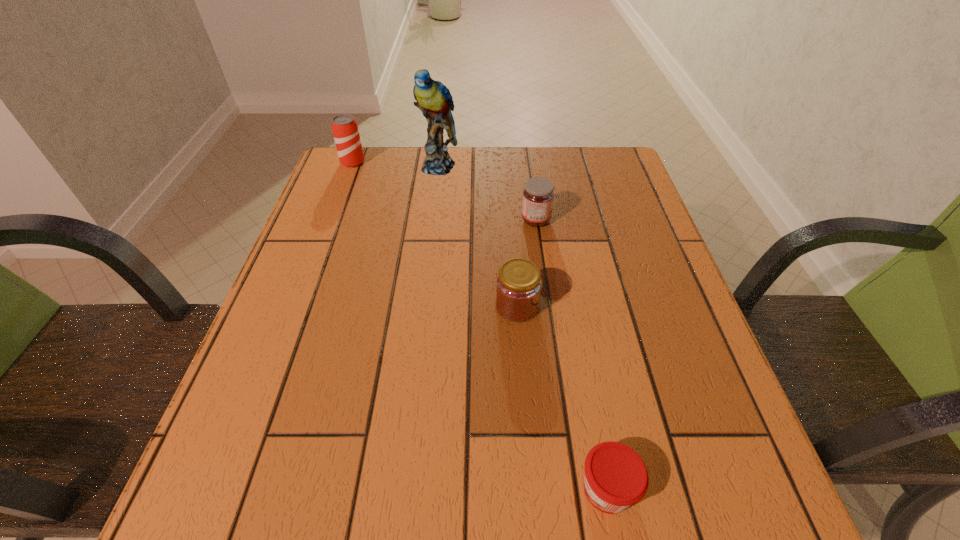
Find the location of a particular element. free space at the far edge of the desktop is located at coordinates (561, 157).

The image size is (960, 540). Find the location of `vacant space at the left edge of the desktop`. vacant space at the left edge of the desktop is located at coordinates (323, 211).

The height and width of the screenshot is (540, 960). In order to click on vacant region at the right edge of the desktop in this screenshot , I will do `click(645, 263)`.

Locate an element on the screen. free space at the far left corner of the desktop is located at coordinates pos(328,191).

The image size is (960, 540). In the image, there is a desktop. Find the location of `vacant space at the far right corner`. vacant space at the far right corner is located at coordinates (586, 153).

Identify the location of free region at the near right corner of the desktop. This screenshot has height=540, width=960. (764, 504).

I want to click on free space between the beer can and the nearest object, so click(x=480, y=326).

In order to click on free spot between the nearest object and the fourth shortest object in this screenshot , I will do `click(480, 326)`.

Where is `free space between the nearest jam and the farthest jam`? The height and width of the screenshot is (540, 960). free space between the nearest jam and the farthest jam is located at coordinates (571, 354).

The width and height of the screenshot is (960, 540). Identify the location of vacant space that's between the shortest jam and the third farthest object. coord(571,354).